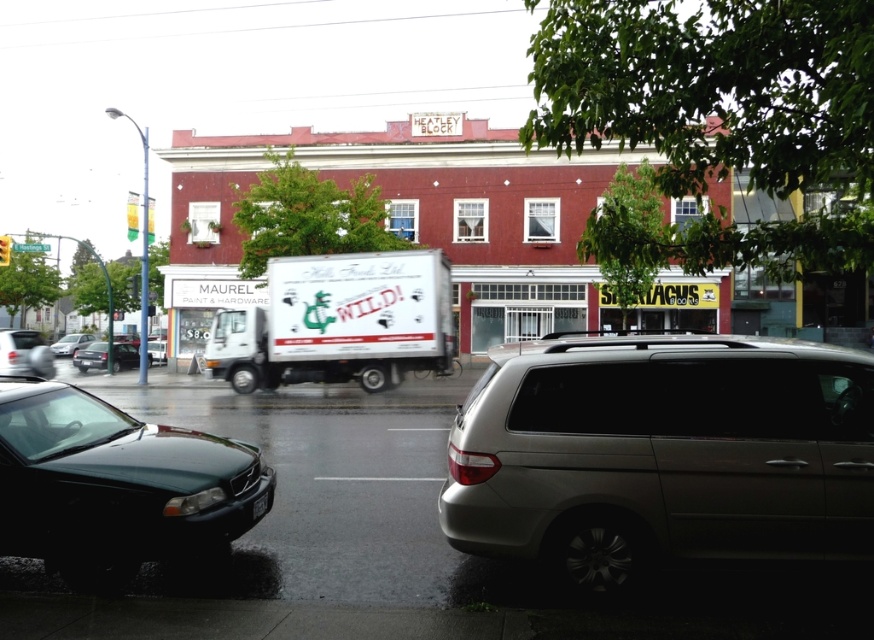
You are standing at the corner of the street and want to take a photo of the HEATLEY BLOCK building without the white matte truck at center blocking the view. Based on its current position, where should you position yourself relative to the truck to ensure the building is fully visible?

Since the white matte truck at center is parked at point (338, 323), positioning yourself to the left or right of the truck would allow you to capture the HEATLEY BLOCK building without obstruction.

You are standing at the corner of the street and want to take a photo of the HEATLEY BLOCK building without any vehicles blocking the view. The silver metallic minivan at lower right is currently parked near the building. Based on its position, can you estimate whether the minivan is close enough to block the view of the building?

The silver metallic minivan at lower right is positioned at point (662, 454), which is near the lower right corner of the image. Since the HEATLEY BLOCK building is the central structure in the scene, the minivan is likely positioned far enough away from the building to not obstruct its view when taking a photo from the corner of the street.

You are a delivery person who needs to park your 1.8 meters wide van between the shiny black sedan at left and the matte black sedan at left. Can you fit your van there?

The shiny black sedan at left has a lesser width compared to matte black sedan at left, so the space between them may be sufficient for your 1.8 meters wide van. However, without knowing the exact distance between the two sedans, it is impossible to determine if the van will fit.